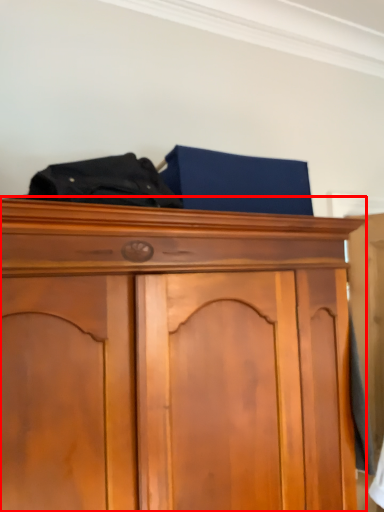
Question: Where is cupboard (annotated by the red box) located in relation to underclothes in the image?

Choices:
 (A) left
 (B) right

Answer: (B)